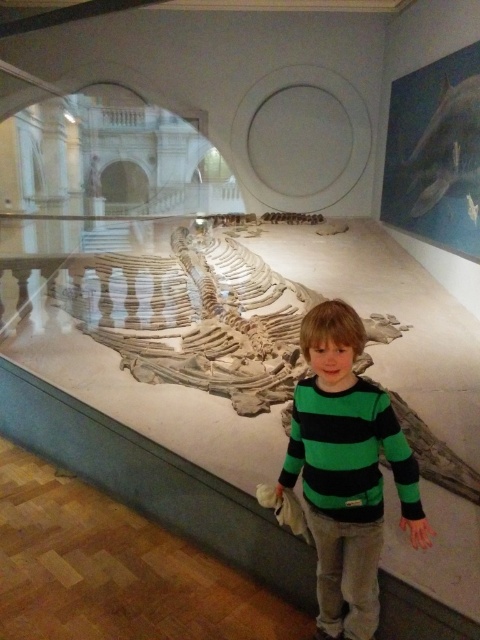
You are a tour guide explaining the whale skeleton exhibit to a group. You notice a child wearing a green striped sweater at center and a gray matte skull at upper right. Which object is located to the left of the other?

The green striped sweater at center is positioned on the left side of gray matte skull at upper right.

You are a visitor in the museum and want to take a photo of the gray matte skull at upper right without the green striped sweater at center appearing in the frame. Is this possible?

The green striped sweater at center is positioned under the gray matte skull at upper right, so if you angle your camera to avoid the lower area where the sweater is located, you can capture the skull without the sweater in the frame.